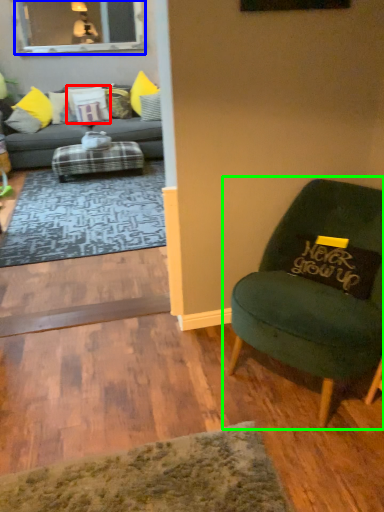
Question: Considering the real-world distances, which object is closest to pillow (highlighted by a red box)? glass door (highlighted by a blue box) or chair (highlighted by a green box).

Choices:
 (A) glass door
 (B) chair

Answer: (A)